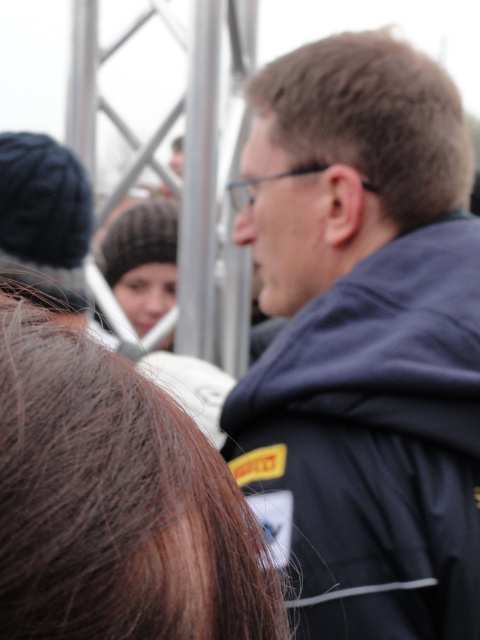
Question: Which object is the closest to the knitted woolen hat at center?

Choices:
 (A) dark blue jacket at upper right
 (B) brown matte hair at upper center

Answer: (A)

Question: Which object appears closest to the camera in this image?

Choices:
 (A) knitted woolen hat at center
 (B) brown matte hair at upper center
 (C) brownhair at upper right
 (D) dark blue jacket at upper right

Answer: (C)

Question: Based on their relative distances, which object is nearer to the brown matte hair at upper center?

Choices:
 (A) knitted woolen hat at center
 (B) brownhair at upper right
 (C) dark blue jacket at upper right

Answer: (C)

Question: Is dark blue jacket at upper right thinner than brownhair at upper right?

Choices:
 (A) no
 (B) yes

Answer: (A)

Question: From the image, what is the correct spatial relationship of dark blue jacket at upper right in relation to brownhair at upper right?

Choices:
 (A) right
 (B) left

Answer: (A)

Question: Can you confirm if dark blue jacket at upper right is smaller than knitted woolen hat at center?

Choices:
 (A) no
 (B) yes

Answer: (A)